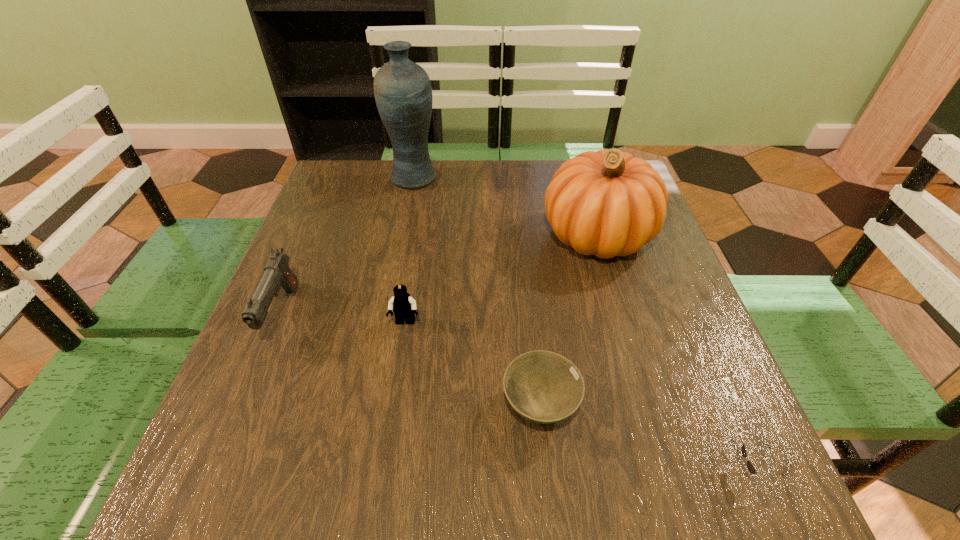
This screenshot has width=960, height=540. Identify the location of object that is at the left edge. (277, 273).

Image resolution: width=960 pixels, height=540 pixels. What are the coordinates of `pumpkin situated at the right edge` in the screenshot? It's located at (607, 203).

Find the location of a particular element. This screenshot has width=960, height=540. sunglasses that is at the right edge is located at coordinates (750, 466).

Locate an element on the screen. The height and width of the screenshot is (540, 960). object that is at the far right corner is located at coordinates (607, 203).

This screenshot has width=960, height=540. What are the coordinates of `object located in the near right corner section of the desktop` in the screenshot? It's located at tap(750, 466).

Locate an element on the screen. free space at the far edge of the desktop is located at coordinates (511, 191).

I want to click on vacant space at the near edge of the desktop, so click(451, 477).

Where is `vacant area at the left edge`? vacant area at the left edge is located at coordinates (325, 264).

You are a GUI agent. You are given a task and a screenshot of the screen. Output one action in this format:
    pyautogui.click(x=<x>, y=<y>)
    Task: Click on the free point at the right edge
    This screenshot has height=540, width=960.
    Given the screenshot: What is the action you would take?
    pyautogui.click(x=715, y=363)

The image size is (960, 540). I want to click on free space at the far left corner, so click(334, 165).